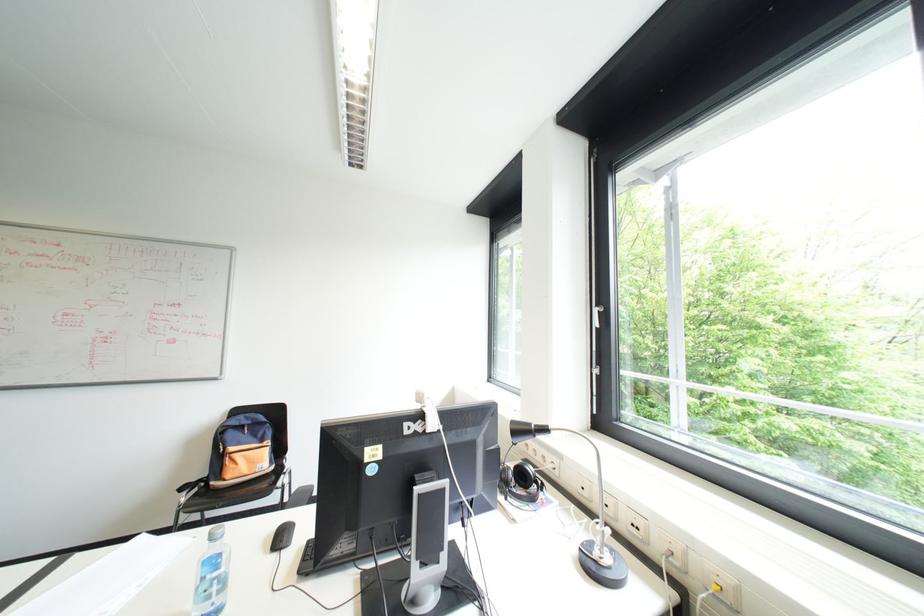
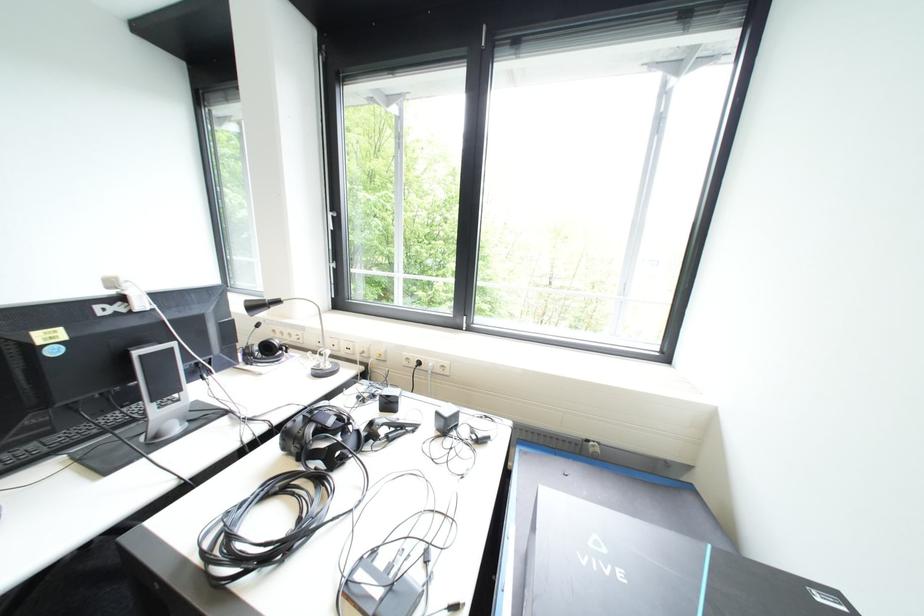
Where in the second image is the point corresponding to the point at 369,464 from the first image?

(40, 347)